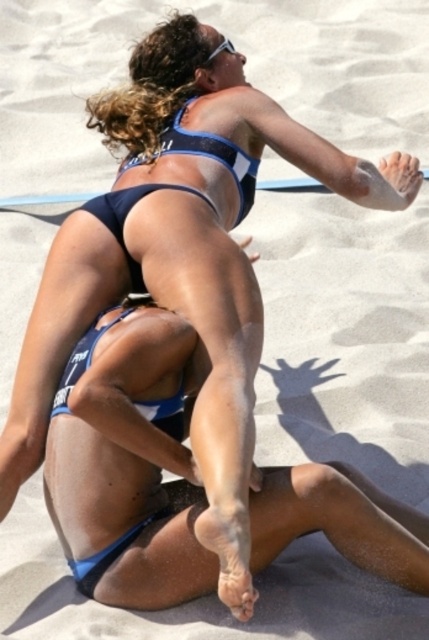
Question: Which point is farther from the camera taking this photo?

Choices:
 (A) (69, 380)
 (B) (138, 266)

Answer: (B)

Question: Which object is closer to the camera taking this photo?

Choices:
 (A) matte blue bikini at center
 (B) blue matte bikini bottom at center

Answer: (B)

Question: Can you confirm if matte blue bikini at center is thinner than blue matte bikini bottom at center?

Choices:
 (A) no
 (B) yes

Answer: (A)

Question: Can you confirm if matte blue bikini at center is smaller than blue matte bikini bottom at center?

Choices:
 (A) no
 (B) yes

Answer: (A)

Question: Does matte blue bikini at center have a smaller size compared to blue matte bikini bottom at center?

Choices:
 (A) yes
 (B) no

Answer: (B)

Question: Which of the following is the closest to the observer?

Choices:
 (A) matte blue bikini at center
 (B) blue matte bikini bottom at center

Answer: (B)